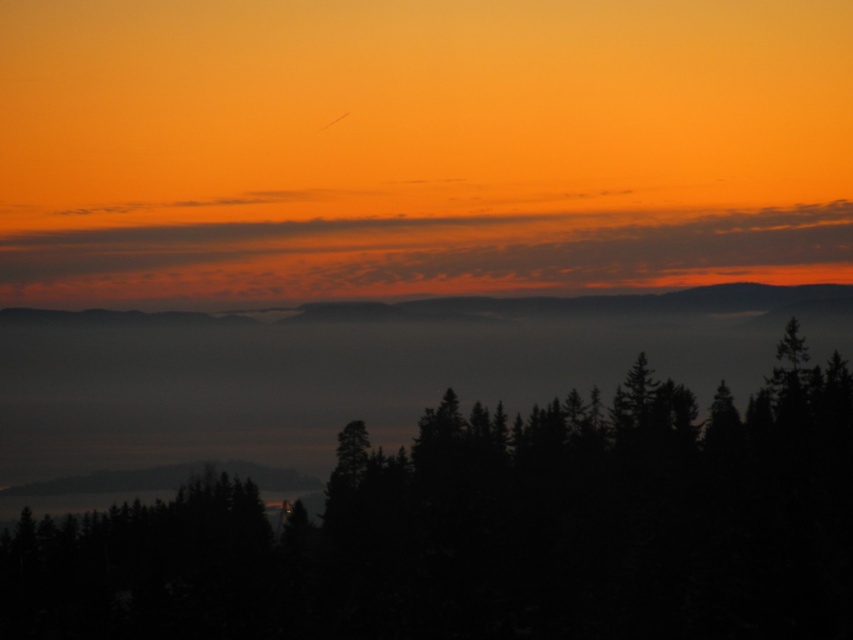
Question: Which point is closer to the camera?

Choices:
 (A) (780, 506)
 (B) (492, 289)

Answer: (A)

Question: Does dark green textured trees at lower center have a greater width compared to matte orange sky at upper center?

Choices:
 (A) yes
 (B) no

Answer: (B)

Question: Which point is closer to the camera?

Choices:
 (A) (532, 433)
 (B) (265, 227)

Answer: (A)

Question: Can you confirm if dark green textured trees at lower center is positioned to the right of matte orange sky at upper center?

Choices:
 (A) yes
 (B) no

Answer: (B)

Question: Is dark green textured trees at lower center thinner than matte orange sky at upper center?

Choices:
 (A) no
 (B) yes

Answer: (B)